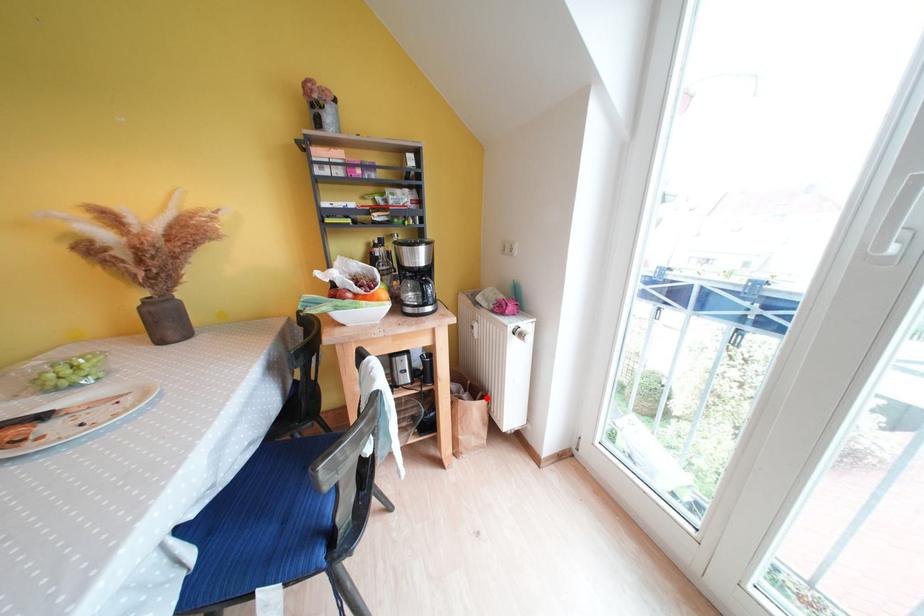
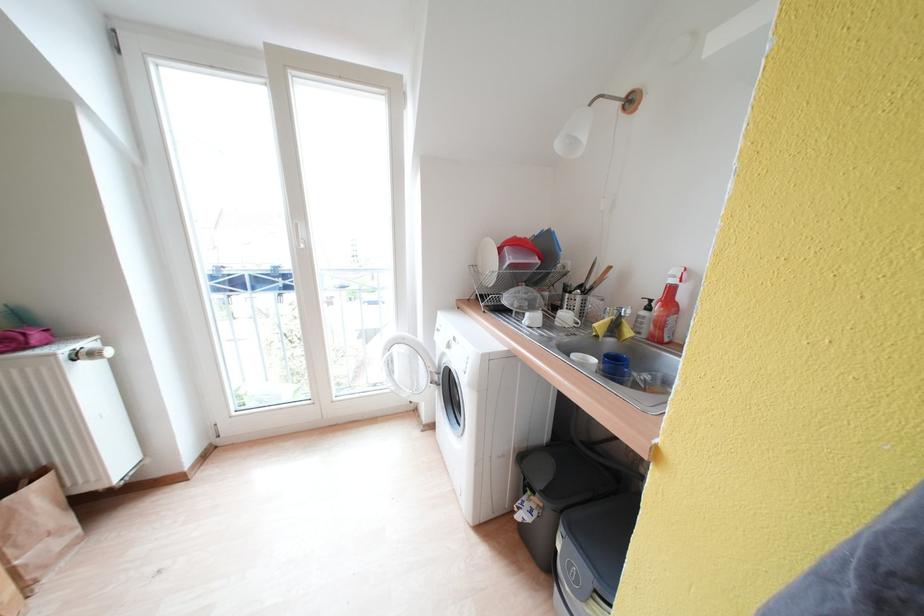
Question: I am providing you with two images of the same scene from different viewpoints. A red point is marked on the first image. Can you still see the location of the red point in image 2?

Choices:
 (A) Yes
 (B) No

Answer: (A)